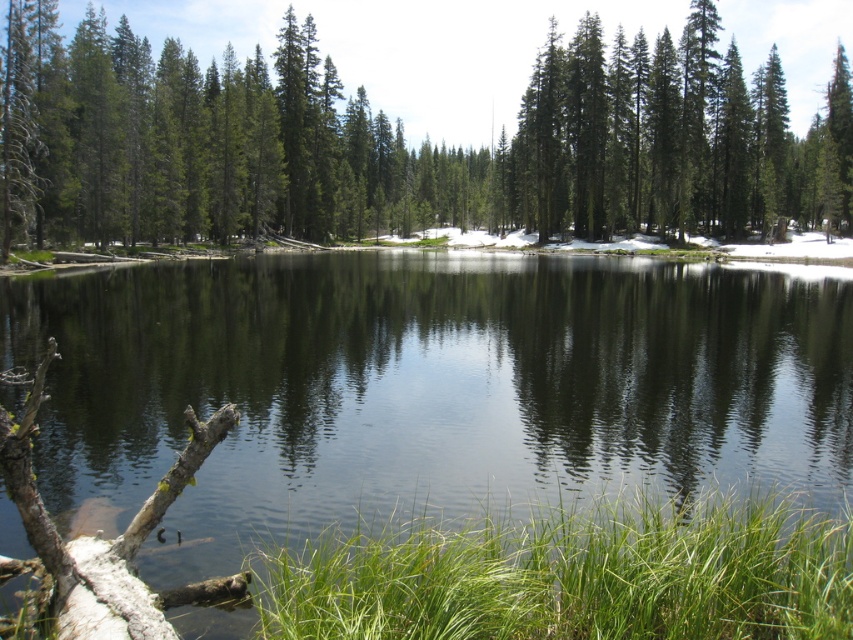
From the picture: You are standing at the edge of the forest and want to cross the transparent water at center. Based on its location, is the water directly in front of you or to the side?

The transparent water at center is located at point (425, 388), which places it directly in front of your position at the edge of the forest.

You are standing at the edge of the forest and see the transparent water at center and the green matte tree at center. Which object is closer to you?

The transparent water at center is closer to you because it is in front of the green matte tree at center.